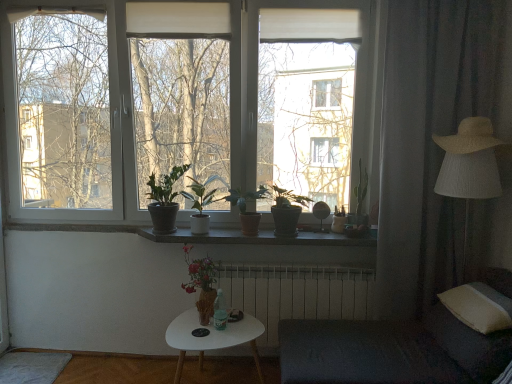
This screenshot has width=512, height=384. I want to click on empty space that is ontop of brown matte window sill at center (from a real-world perspective), so click(x=267, y=235).